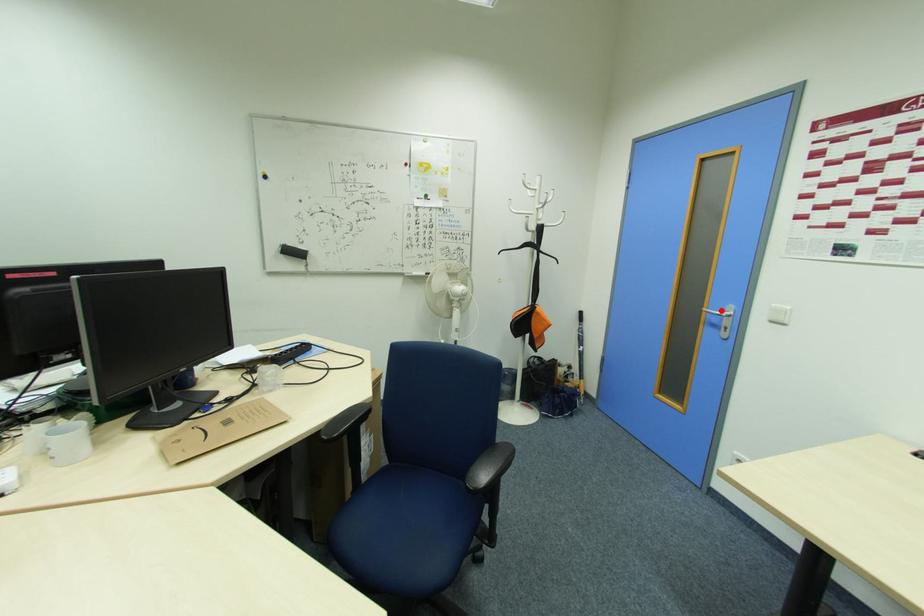
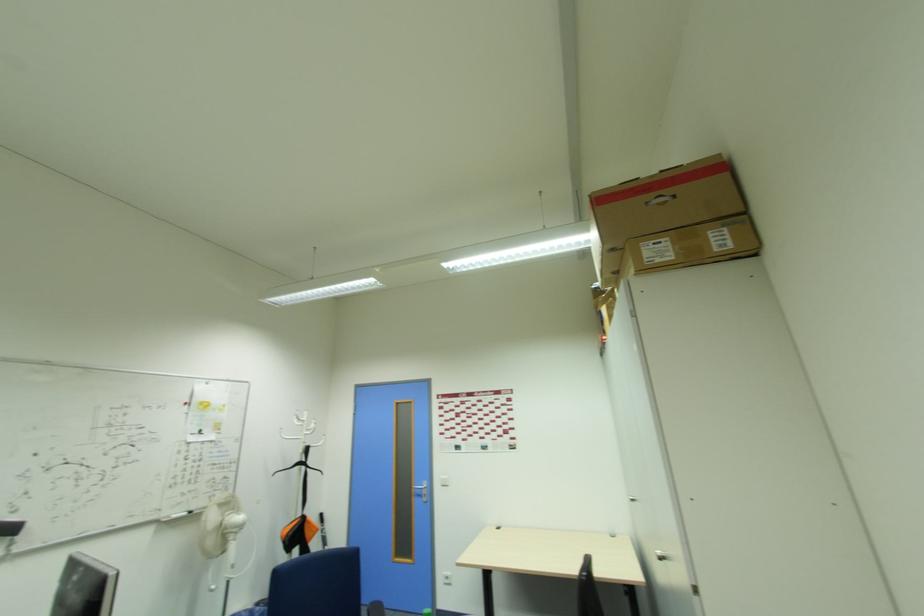
Question: I am providing you with two images of the same scene from different viewpoints. Given a red point in image1, look at the same physical point in image2. Is it:

Choices:
 (A) Closer to the viewpoint
 (B) Farther from the viewpoint

Answer: (B)